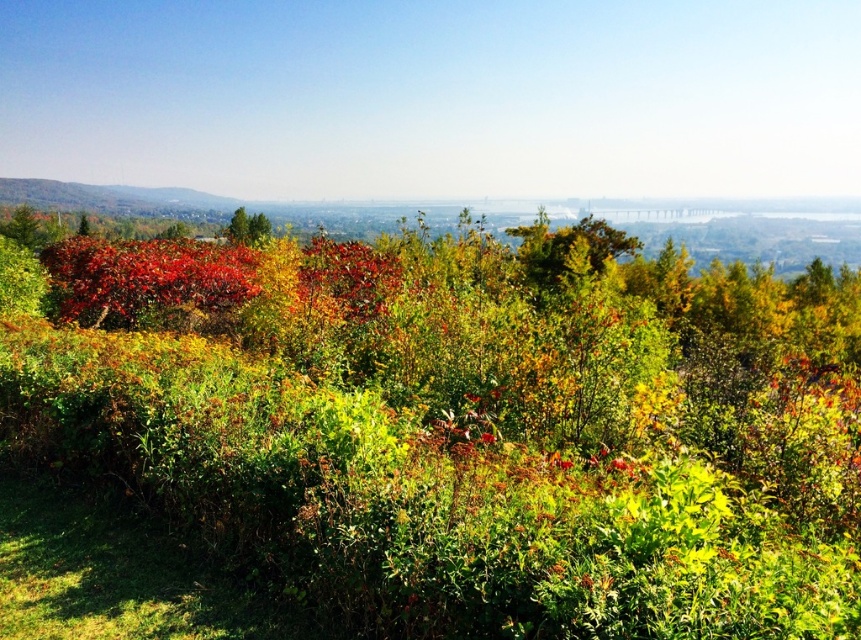
You are an artist planning to paint the autumn landscape. You want to ensure the shiny red leaves at center and the green matte tree at center are proportionate. Which object should you make smaller in your painting to maintain the correct proportions?

The shiny red leaves at center has a lesser width compared to the green matte tree at center, so you should make the shiny red leaves at center smaller than the green matte tree at center in your painting to maintain correct proportions.

You are an artist planning to paint the autumn landscape. You want to ensure the shiny red leaves at center and the green matte tree at center are proportionally accurate. Which object should you paint smaller in your artwork?

The shiny red leaves at center should be painted smaller because they are not as tall as the green matte tree at center.

You are an artist trying to paint the autumn landscape. You want to place the shiny red leaves at center in your painting. Where exactly should you paint them?

You should paint the shiny red leaves at center at point (x=146, y=276).